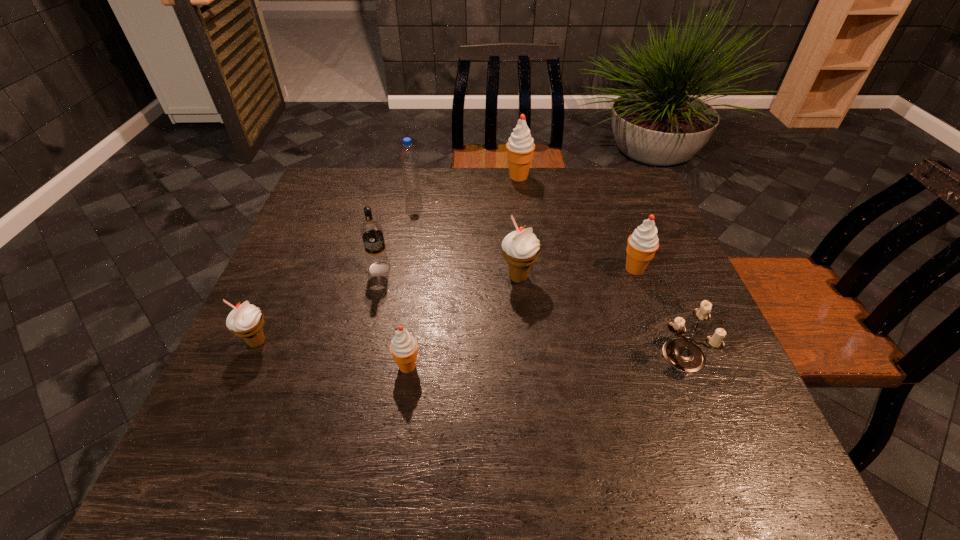
Locate an element on the screen. free space located 0.260m on the right of the leftmost icecream is located at coordinates (396, 342).

Where is `icecream positioned at the far edge`? The height and width of the screenshot is (540, 960). icecream positioned at the far edge is located at coordinates (520, 147).

Image resolution: width=960 pixels, height=540 pixels. Identify the location of water bottle present at the far edge. pyautogui.click(x=412, y=186).

Locate an element on the screen. The image size is (960, 540). object situated at the left edge is located at coordinates (246, 320).

This screenshot has width=960, height=540. I want to click on icecream that is at the right edge, so click(642, 244).

The width and height of the screenshot is (960, 540). Find the location of `candle holder located at the right edge`. candle holder located at the right edge is located at coordinates (683, 355).

In order to click on vacant space at the far edge of the desktop in this screenshot , I will do `click(391, 172)`.

Image resolution: width=960 pixels, height=540 pixels. I want to click on blank area at the near edge, so click(452, 470).

Locate an element on the screen. This screenshot has height=540, width=960. vacant space at the left edge of the desktop is located at coordinates (323, 243).

Find the location of a particular element. free space at the right edge is located at coordinates (670, 318).